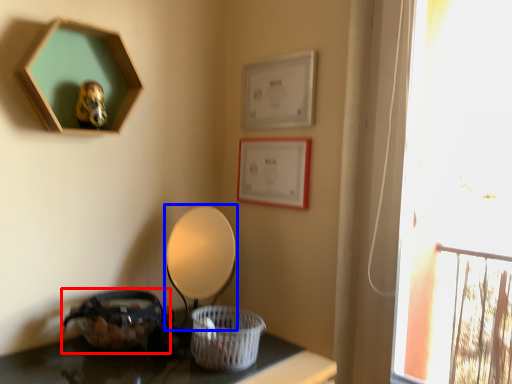
Question: Which of the following is the closest to the observer, basket (highlighted by a red box) or table lamp (highlighted by a blue box)?

Choices:
 (A) basket
 (B) table lamp

Answer: (A)